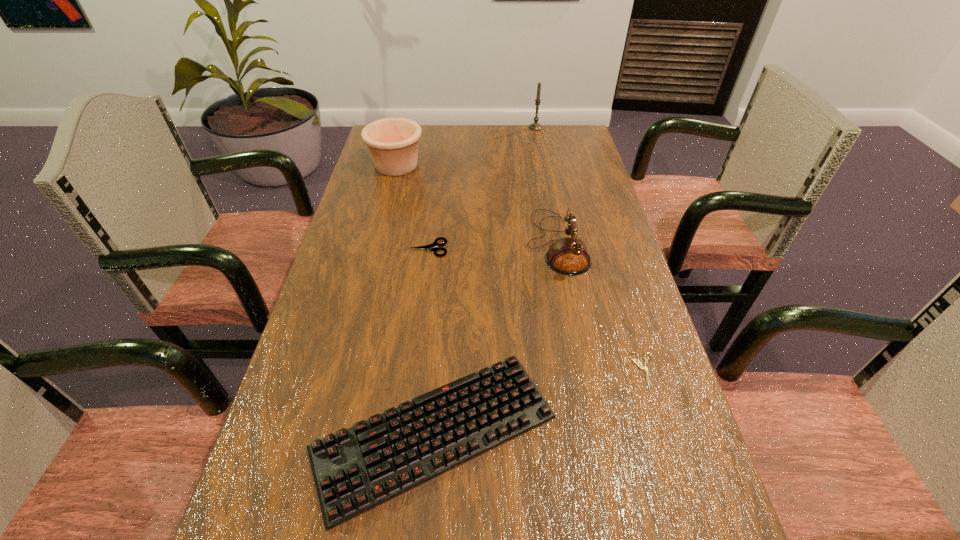
The height and width of the screenshot is (540, 960). In order to click on free point located on the back of the pottery in this screenshot , I will do `click(402, 144)`.

This screenshot has height=540, width=960. In order to click on free space located on the rotary dial of the telephone in this screenshot , I will do `click(452, 243)`.

At what (x,y) coordinates should I click in order to perform the action: click on free space located 0.170m on the rotary dial of the telephone. Please return your answer as a coordinate pair (x, y). Image resolution: width=960 pixels, height=540 pixels. Looking at the image, I should click on (464, 243).

The height and width of the screenshot is (540, 960). Find the location of `free space located on the rotary dial of the telephone`. free space located on the rotary dial of the telephone is located at coordinates (389, 243).

Where is `vacant space located 0.150m on the back of the computer keyboard`? vacant space located 0.150m on the back of the computer keyboard is located at coordinates (444, 305).

At what (x,y) coordinates should I click in order to perform the action: click on vacant space located on the right of the tallest shears. Please return your answer as a coordinate pair (x, y). The width and height of the screenshot is (960, 540). Looking at the image, I should click on (523, 248).

Where is `vacant space located 0.130m on the back of the second farthest shears`? vacant space located 0.130m on the back of the second farthest shears is located at coordinates (625, 306).

Identify the location of candle that is positioned at the far edge. The height and width of the screenshot is (540, 960). (535, 126).

The height and width of the screenshot is (540, 960). I want to click on pottery located at the far edge, so click(392, 142).

Identify the location of pottery situated at the left edge. [x=392, y=142].